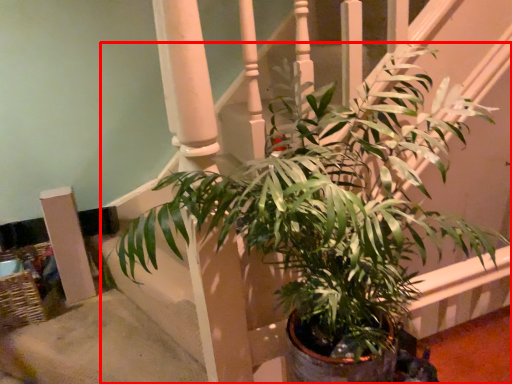
Question: From the image's perspective, considering the relative positions of houseplant (annotated by the red box) and pillar in the image provided, where is houseplant (annotated by the red box) located with respect to the staircase?

Choices:
 (A) above
 (B) below

Answer: (A)